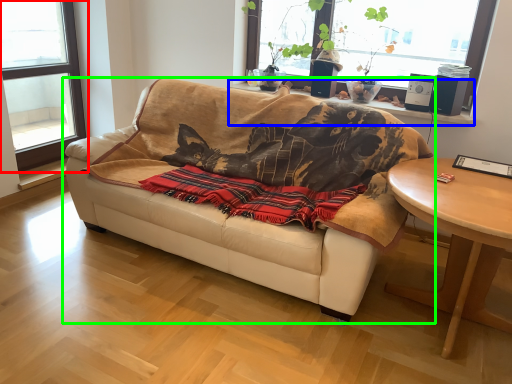
Question: Based on their relative distances, which object is nearer to window (highlighted by a red box)? Choose from window sill (highlighted by a blue box) and studio couch (highlighted by a green box).

Choices:
 (A) window sill
 (B) studio couch

Answer: (B)